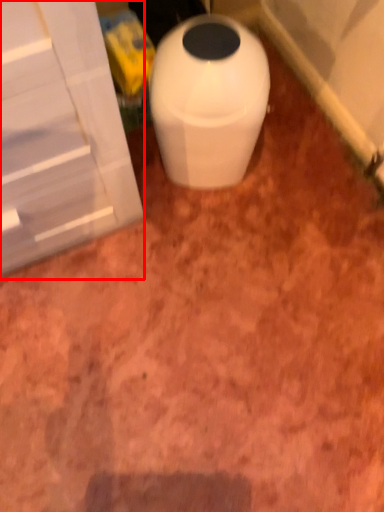
Question: From the image's perspective, considering the relative positions of screen door (annotated by the red box) and waste container in the image provided, where is screen door (annotated by the red box) located with respect to the staircase?

Choices:
 (A) above
 (B) below

Answer: (A)